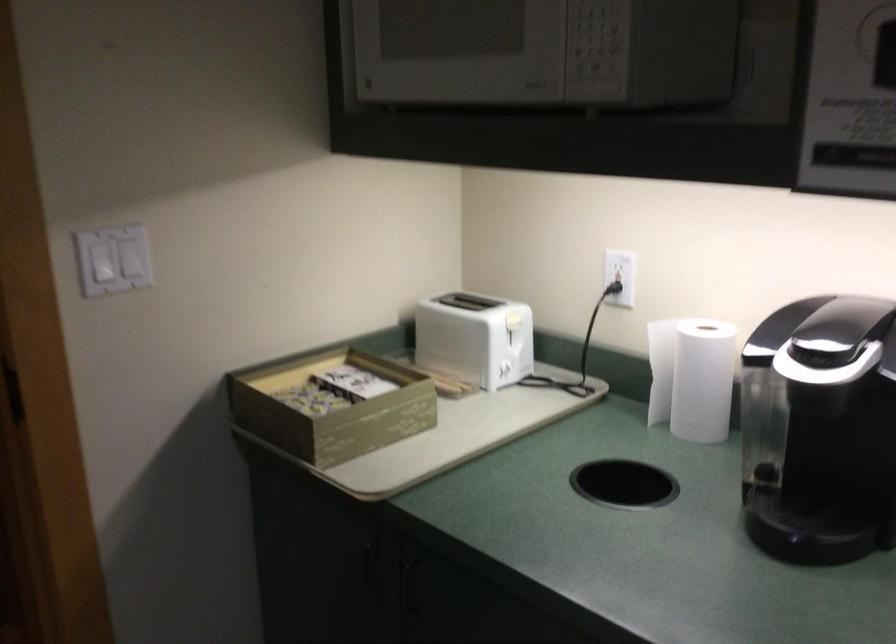
You are a GUI agent. You are given a task and a screenshot of the screen. Output one action in this format:
    pyautogui.click(x=<x>, y=<y>)
    Task: Click on the toaster lever
    
    Given the screenshot: What is the action you would take?
    pyautogui.click(x=511, y=317)